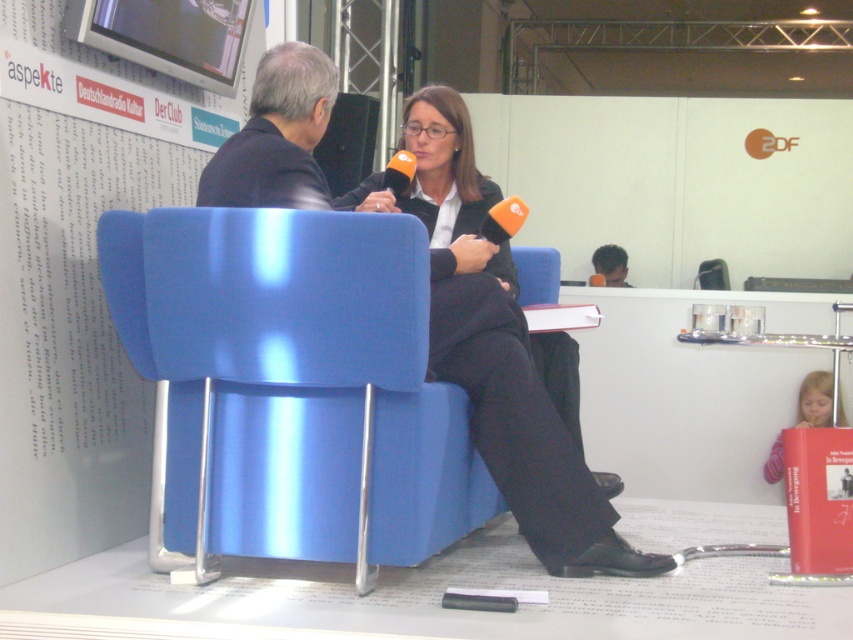
You are a photographer positioned at the origin point of the image. You want to capture a closeup shot of the matte black blazer at center. Which direction should you move your camera to focus on it?

The matte black blazer at center is located at point 0.530 on the x axis and 0.579 on the y axis. Since the origin is at the bottom left corner, you should move your camera to the right and upwards to focus on it.

You are a photographer positioned behind the interviewer holding the orange microphones. You need to ensure both the matte black blazer at center and the matte black suit at center are visible in your shot. Based on their positions, which one might partially block the other?

The matte black blazer at center is in front of the matte black suit at center, so the matte black blazer at center may partially block the matte black suit at center in the photo.